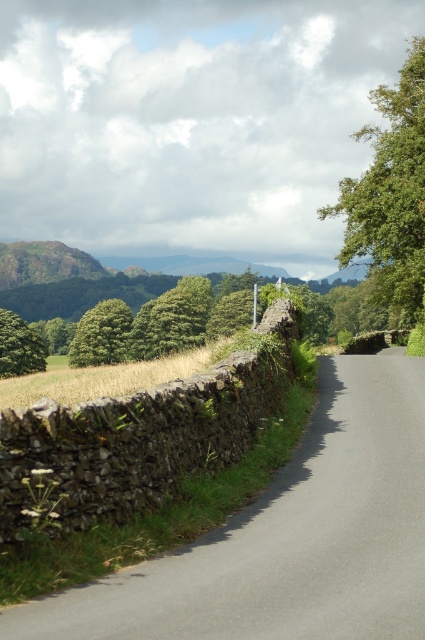
Does green leafy tree at upper left appear on the right side of green leafy tree at left?

Indeed, green leafy tree at upper left is positioned on the right side of green leafy tree at left.

Between point (85, 362) and point (28, 355), which one is positioned in front?

Point (28, 355)

I want to click on green leafy tree at upper left, so click(x=102, y=333).

Based on the photo, is green leafy tree at upper right shorter than green leafy tree at upper left?

In fact, green leafy tree at upper right may be taller than green leafy tree at upper left.

Is the position of green leafy tree at upper right more distant than that of green leafy tree at upper left?

No, green leafy tree at upper right is closer to the viewer.

This screenshot has width=425, height=640. I want to click on green leafy tree at upper right, so click(391, 193).

Which is behind, point (394, 136) or point (34, 369)?

Positioned behind is point (34, 369).

Is point (421, 112) positioned after point (11, 336)?

No, (421, 112) is in front of (11, 336).

Which is behind, point (405, 90) or point (5, 353)?

The point (5, 353) is behind.

Find the location of a particular element. green leafy tree at upper right is located at coordinates (391, 193).